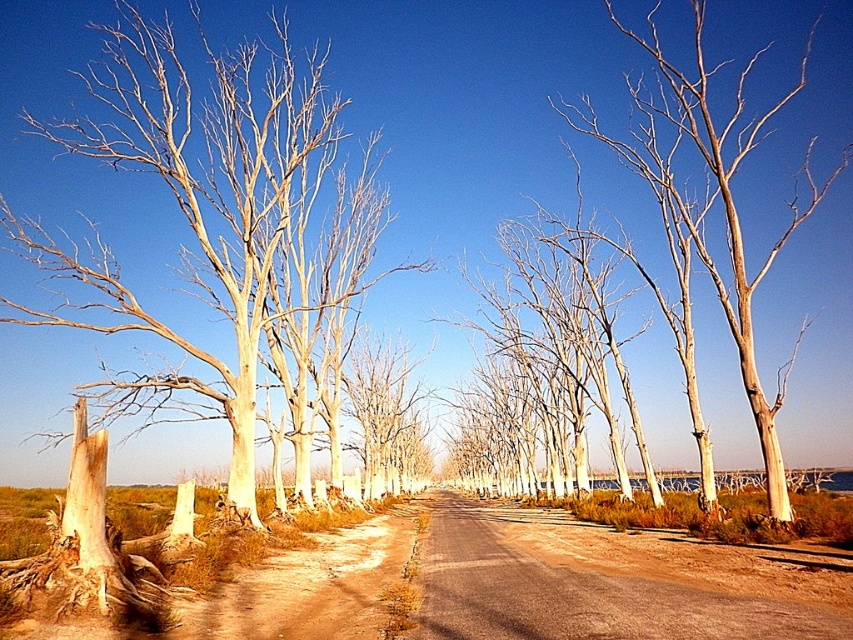
Can you confirm if light brown bark tree at left is shorter than brown dirt track at center?

In fact, light brown bark tree at left may be taller than brown dirt track at center.

Can you confirm if light brown bark tree at left is positioned below brown dirt track at center?

Incorrect, light brown bark tree at left is not positioned below brown dirt track at center.

Which is behind, point (241, 257) or point (527, 620)?

The point (241, 257) is behind.

At what (x,y) coordinates should I click in order to perform the action: click on light brown bark tree at left. Please return your answer as a coordinate pair (x, y). The height and width of the screenshot is (640, 853). Looking at the image, I should click on (193, 204).

Is point (544, 540) behind point (807, 40)?

No, it is in front of (807, 40).

Does point (555, 632) come closer to viewer compared to point (734, 240)?

Yes, point (555, 632) is in front of point (734, 240).

Identify the location of brown dirt track at center. The image size is (853, 640). (614, 580).

Is light brown bark tree at left closer to camera compared to smooth bark tree at center?

No, it is not.

Between point (189, 84) and point (802, 67), which one is positioned behind?

The point (802, 67) is more distant.

The height and width of the screenshot is (640, 853). Find the location of `light brown bark tree at left`. light brown bark tree at left is located at coordinates (193, 204).

At what (x,y) coordinates should I click in order to perform the action: click on light brown bark tree at left. Please return your answer as a coordinate pair (x, y). Looking at the image, I should click on (193, 204).